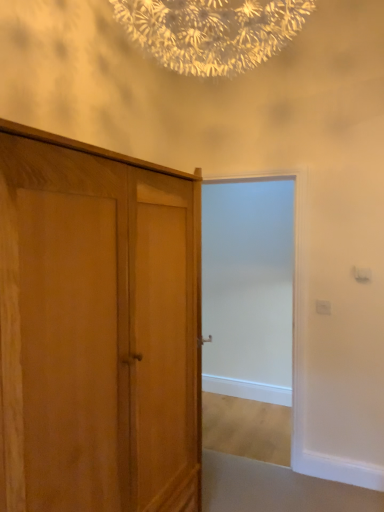
The width and height of the screenshot is (384, 512). I want to click on white frosted glass door at center, so click(248, 289).

Image resolution: width=384 pixels, height=512 pixels. Describe the element at coordinates (248, 289) in the screenshot. I see `white frosted glass door at center` at that location.

This screenshot has height=512, width=384. What do you see at coordinates (97, 329) in the screenshot?
I see `wooden wardrobe at left` at bounding box center [97, 329].

You are a GUI agent. You are given a task and a screenshot of the screen. Output one action in this format:
    pyautogui.click(x=<x>, y=<y>)
    Task: Click on the wooden wardrobe at left
    The height and width of the screenshot is (512, 384).
    Given the screenshot: What is the action you would take?
    pyautogui.click(x=97, y=329)

At what (x,y) coordinates should I click in order to perform the action: click on white frosted glass door at center. Please return your answer as a coordinate pair (x, y). Looking at the image, I should click on (248, 289).

Would you say wooden wardrobe at left is to the left or to the right of white frosted glass door at center in the picture?

wooden wardrobe at left is to the left of white frosted glass door at center.

Is the depth of wooden wardrobe at left less than that of white frosted glass door at center?

That is True.

Considering the positions of points (173, 210) and (219, 287), is point (173, 210) closer to camera compared to point (219, 287)?

Yes, point (173, 210) is closer to viewer.

From the image's perspective, which object appears higher, wooden wardrobe at left or white frosted glass door at center?

white frosted glass door at center, from the image's perspective.

From a real-world perspective, which is physically below, wooden wardrobe at left or white frosted glass door at center?

wooden wardrobe at left.

Is wooden wardrobe at left wider than white frosted glass door at center?

Yes.

Which of these two, wooden wardrobe at left or white frosted glass door at center, stands taller?

Standing taller between the two is white frosted glass door at center.

In terms of size, does wooden wardrobe at left appear bigger or smaller than white frosted glass door at center?

Considering their sizes, wooden wardrobe at left takes up more space than white frosted glass door at center.

Is wooden wardrobe at left situated inside white frosted glass door at center or outside?

The correct answer is: outside.

Based on the photo, are wooden wardrobe at left and white frosted glass door at center beside each other?

No.

Is wooden wardrobe at left facing away from white frosted glass door at center?

No, wooden wardrobe at left's orientation is not away from white frosted glass door at center.

What's the angular difference between wooden wardrobe at left and white frosted glass door at center's facing directions?

The facing directions of wooden wardrobe at left and white frosted glass door at center are 89.8 degrees apart.

Where is `cupboard below the white frosted glass door at center (from the image's perspective)`? The image size is (384, 512). cupboard below the white frosted glass door at center (from the image's perspective) is located at coordinates (97, 329).

Between white frosted glass door at center and wooden wardrobe at left, which one appears on the right side from the viewer's perspective?

white frosted glass door at center is more to the right.

Considering the positions of objects white frosted glass door at center and wooden wardrobe at left in the image provided, who is in front, white frosted glass door at center or wooden wardrobe at left?

Positioned in front is wooden wardrobe at left.

Considering the points (217, 271) and (27, 154), which point is in front, point (217, 271) or point (27, 154)?

The point (27, 154) is closer.

From the image's perspective, relative to wooden wardrobe at left, is white frosted glass door at center above or below?

Clearly, from the image's perspective, white frosted glass door at center is above wooden wardrobe at left.

From a real-world perspective, relative to wooden wardrobe at left, is white frosted glass door at center vertically above or below?

In terms of real-world spatial position, white frosted glass door at center is above wooden wardrobe at left.

Considering the sizes of objects white frosted glass door at center and wooden wardrobe at left in the image provided, who is wider, white frosted glass door at center or wooden wardrobe at left?

Wider between the two is wooden wardrobe at left.

Can you confirm if white frosted glass door at center is shorter than wooden wardrobe at left?

In fact, white frosted glass door at center may be taller than wooden wardrobe at left.

Based on the photo, is white frosted glass door at center bigger than wooden wardrobe at left?

No, white frosted glass door at center is not bigger than wooden wardrobe at left.

Consider the image. Choose the correct answer: Is white frosted glass door at center inside wooden wardrobe at left or outside it?

white frosted glass door at center cannot be found inside wooden wardrobe at left.

Based on the photo, is white frosted glass door at center directly adjacent to wooden wardrobe at left?

No, white frosted glass door at center is not with wooden wardrobe at left.

Does white frosted glass door at center turn towards wooden wardrobe at left?

Yes, white frosted glass door at center is oriented towards wooden wardrobe at left.

I want to click on screen door above the wooden wardrobe at left (from a real-world perspective), so click(x=248, y=289).

Where is `cupboard in front of the white frosted glass door at center`? This screenshot has height=512, width=384. cupboard in front of the white frosted glass door at center is located at coordinates (97, 329).

Image resolution: width=384 pixels, height=512 pixels. I want to click on cupboard below the white frosted glass door at center (from a real-world perspective), so click(97, 329).